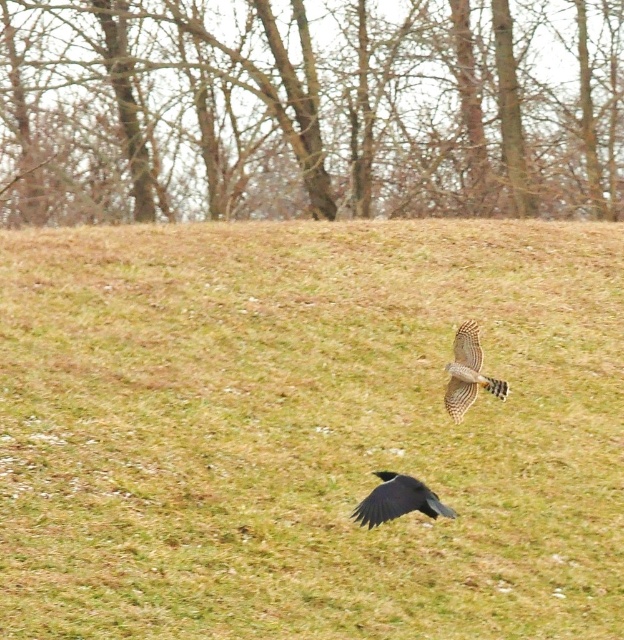
Question: Which point is farther from the camera taking this photo?

Choices:
 (A) (470, 385)
 (B) (444, 509)
 (C) (500, 316)
 (D) (439, 134)

Answer: (D)

Question: Which point appears farthest from the camera in this image?

Choices:
 (A) (492, 266)
 (B) (401, 132)

Answer: (B)

Question: Can you confirm if brown bark trees at upper center is positioned to the right of speckled brown eagle at center?

Choices:
 (A) no
 (B) yes

Answer: (B)

Question: Among these objects, which one is farthest from the camera?

Choices:
 (A) brown bark trees at upper center
 (B) green grass at center

Answer: (A)

Question: Does brown bark trees at upper center have a larger size compared to speckled brown eagle at center?

Choices:
 (A) no
 (B) yes

Answer: (B)

Question: Does green grass at center have a larger size compared to brown bark trees at upper center?

Choices:
 (A) no
 (B) yes

Answer: (A)